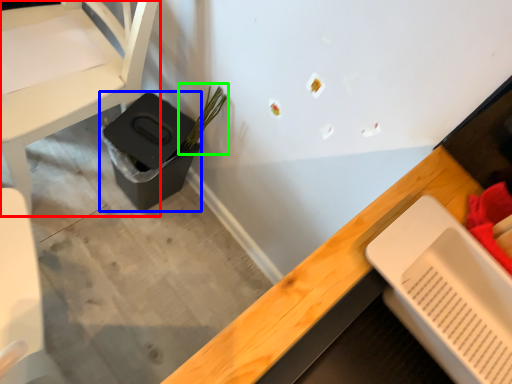
Question: Which object is the farthest from chair (highlighted by a red box)? Choose among these: potty (highlighted by a blue box) or plant (highlighted by a green box).

Choices:
 (A) potty
 (B) plant

Answer: (B)